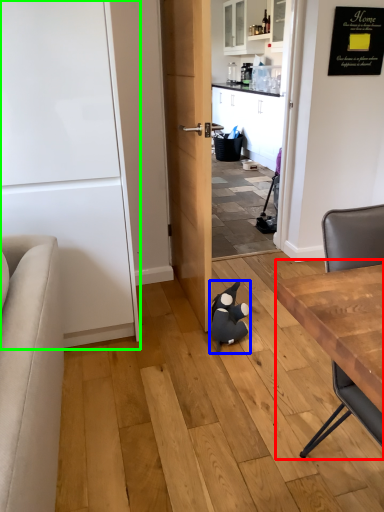
Question: Which object is positioned closest to table (highlighted by a red box)? Select from animal (highlighted by a blue box) and door (highlighted by a green box).

Choices:
 (A) animal
 (B) door

Answer: (A)